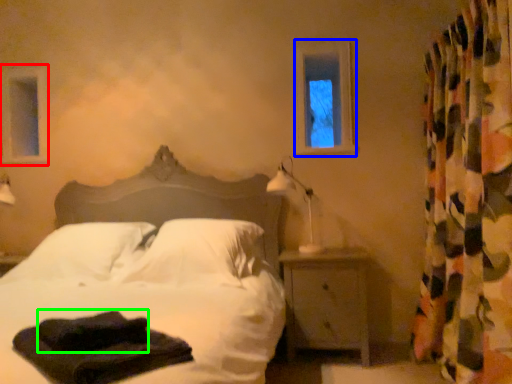
Question: Which object is the closest to the window frame (highlighted by a red box)? Choose among these: window frame (highlighted by a blue box) or material (highlighted by a green box).

Choices:
 (A) window frame
 (B) material

Answer: (A)